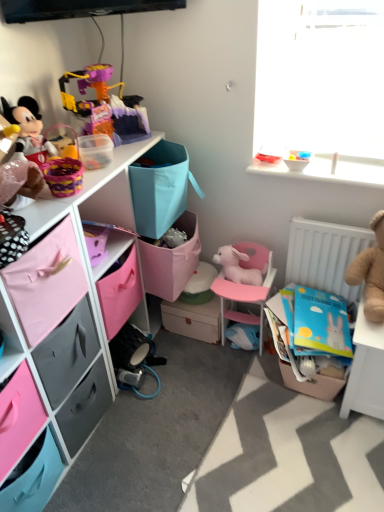
Image resolution: width=384 pixels, height=512 pixels. In order to click on free space between matte pink storage box at center, arranged as the 2th storage box when viewed from the front, and pink plastic chair at center in this screenshot , I will do `click(191, 346)`.